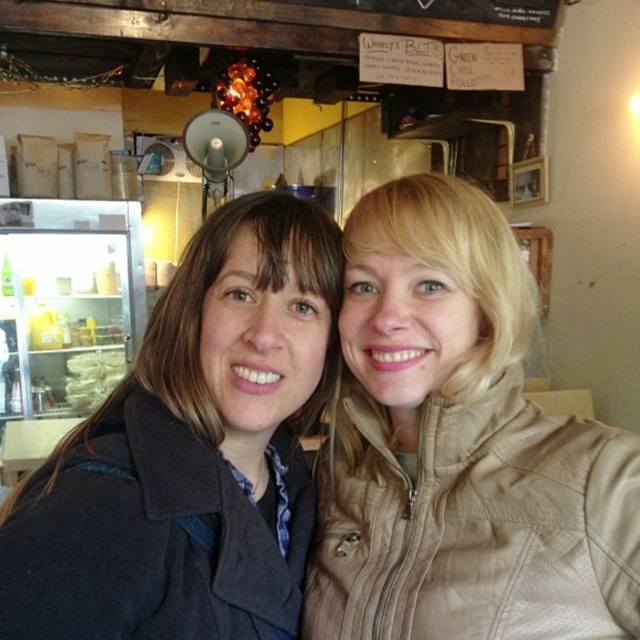
Question: Which of the following is the farthest from the observer?

Choices:
 (A) tan leather jacket at center
 (B) dark blue wool coat at center

Answer: (A)

Question: Is tan leather jacket at center closer to the viewer compared to dark blue wool coat at center?

Choices:
 (A) yes
 (B) no

Answer: (B)

Question: Is tan leather jacket at center positioned at the back of dark blue wool coat at center?

Choices:
 (A) yes
 (B) no

Answer: (A)

Question: Which object appears closest to the camera in this image?

Choices:
 (A) dark blue wool coat at center
 (B) tan leather jacket at center

Answer: (A)

Question: Is tan leather jacket at center wider than dark blue wool coat at center?

Choices:
 (A) yes
 (B) no

Answer: (B)